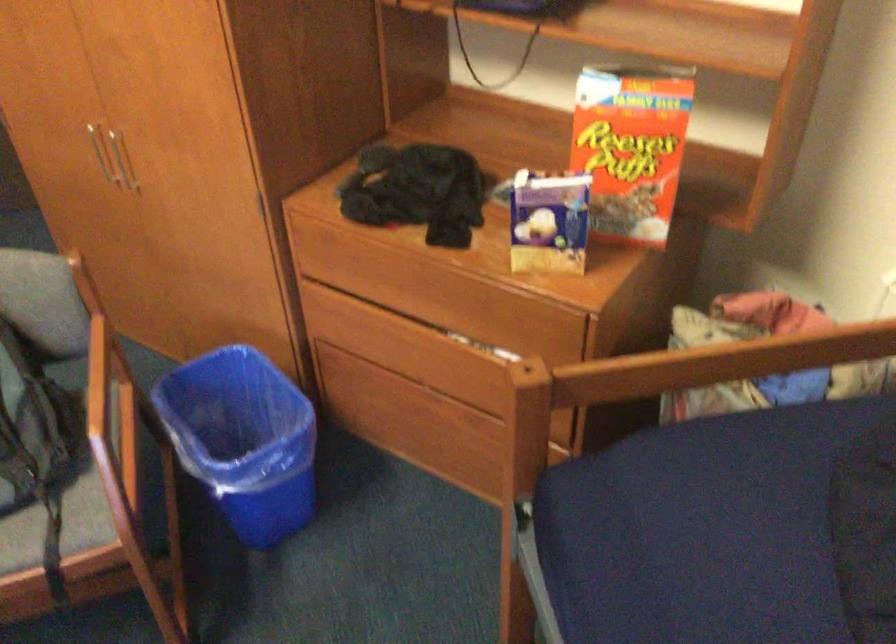
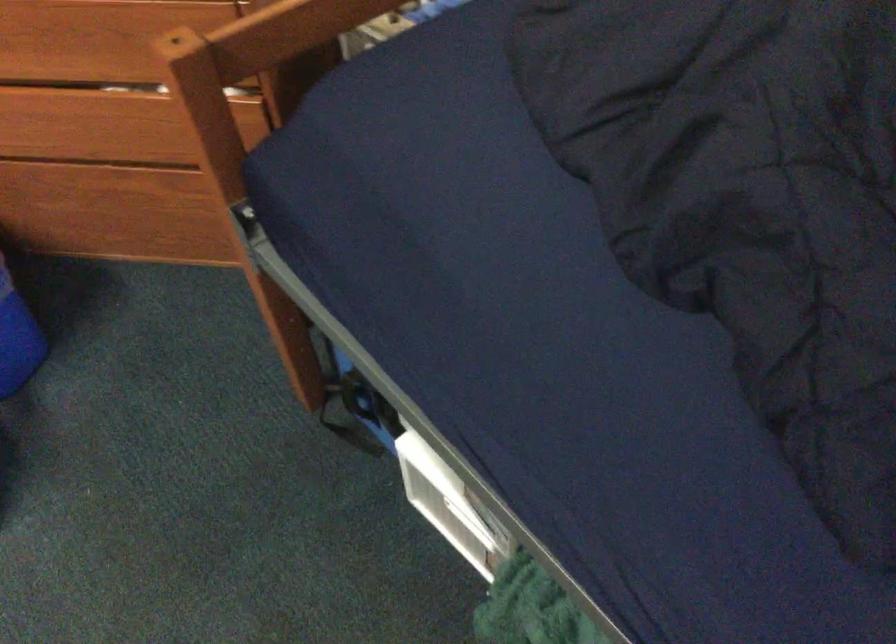
Question: The first image is from the beginning of the video and the second image is from the end. How did the camera likely rotate when shooting the video?

Choices:
 (A) Left
 (B) Right
 (C) Up
 (D) Down

Answer: (D)